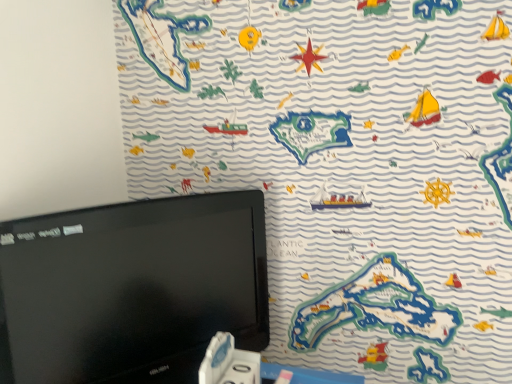
In order to face white plastic game controller at bottom, should I rotate leftwards or rightwards?

A 3.357 degree turn to the left will do.

I want to click on white plastic game controller at bottom, so click(228, 363).

Image resolution: width=512 pixels, height=384 pixels. Describe the element at coordinates (228, 363) in the screenshot. I see `white plastic game controller at bottom` at that location.

What do you see at coordinates (131, 289) in the screenshot?
I see `black glossy monitor at upper left` at bounding box center [131, 289].

Where is `black glossy monitor at upper left`? This screenshot has width=512, height=384. black glossy monitor at upper left is located at coordinates point(131,289).

The image size is (512, 384). Identify the location of white plastic game controller at bottom. (228, 363).

Can you confirm if black glossy monitor at upper left is positioned to the left of white plastic game controller at bottom?

Yes.

Is black glossy monitor at upper left in front of or behind white plastic game controller at bottom in the image?

Visually, black glossy monitor at upper left is located in front of white plastic game controller at bottom.

Does point (95, 359) lie in front of point (224, 333)?

Yes.

From the image's perspective, which one is positioned higher, black glossy monitor at upper left or white plastic game controller at bottom?

black glossy monitor at upper left is shown above in the image.

From a real-world perspective, is black glossy monitor at upper left over white plastic game controller at bottom?

Yes, from a real-world perspective, black glossy monitor at upper left is over white plastic game controller at bottom

Between black glossy monitor at upper left and white plastic game controller at bottom, which one has smaller width?

white plastic game controller at bottom.

Does black glossy monitor at upper left have a greater height compared to white plastic game controller at bottom?

Indeed, black glossy monitor at upper left has a greater height compared to white plastic game controller at bottom.

In the scene shown: Is black glossy monitor at upper left bigger than white plastic game controller at bottom?

Yes.

Is white plastic game controller at bottom inside black glossy monitor at upper left?

Actually, white plastic game controller at bottom is outside black glossy monitor at upper left.

Are black glossy monitor at upper left and white plastic game controller at bottom located far from each other?

No.

Is white plastic game controller at bottom at the back of black glossy monitor at upper left?

Yes, black glossy monitor at upper left is positioned with its back facing white plastic game controller at bottom.

How many degrees apart are the facing directions of black glossy monitor at upper left and white plastic game controller at bottom?

The angle between the facing direction of black glossy monitor at upper left and the facing direction of white plastic game controller at bottom is 35 degrees.

At what (x,y) coordinates should I click in order to perform the action: click on game controller behind the black glossy monitor at upper left. Please return your answer as a coordinate pair (x, y). The width and height of the screenshot is (512, 384). Looking at the image, I should click on (228, 363).

Is white plastic game controller at bottom at the left side of black glossy monitor at upper left?

In fact, white plastic game controller at bottom is to the right of black glossy monitor at upper left.

Is white plastic game controller at bottom positioned before black glossy monitor at upper left?

No, white plastic game controller at bottom is further to the viewer.

Which is farther from the camera, (x=254, y=355) or (x=251, y=208)?

The point (x=251, y=208) is behind.

Consider the image. From the image's perspective, which object appears higher, white plastic game controller at bottom or black glossy monitor at upper left?

black glossy monitor at upper left appears higher in the image.

From a real-world perspective, who is located higher, white plastic game controller at bottom or black glossy monitor at upper left?

black glossy monitor at upper left.

Does white plastic game controller at bottom have a greater width compared to black glossy monitor at upper left?

Incorrect, the width of white plastic game controller at bottom does not surpass that of black glossy monitor at upper left.

In terms of height, does white plastic game controller at bottom look taller or shorter compared to black glossy monitor at upper left?

white plastic game controller at bottom is shorter than black glossy monitor at upper left.

Considering the sizes of objects white plastic game controller at bottom and black glossy monitor at upper left in the image provided, who is bigger, white plastic game controller at bottom or black glossy monitor at upper left?

black glossy monitor at upper left.

Choose the correct answer: Is white plastic game controller at bottom inside black glossy monitor at upper left or outside it?

white plastic game controller at bottom is located beyond the bounds of black glossy monitor at upper left.

From the picture: Is white plastic game controller at bottom far away from black glossy monitor at upper left?

They are positioned close to each other.

Is white plastic game controller at bottom oriented away from black glossy monitor at upper left?

Yes.

How different are the orientations of white plastic game controller at bottom and black glossy monitor at upper left in degrees?

35 degrees.

Measure the distance between white plastic game controller at bottom and black glossy monitor at upper left.

A distance of 18.97 centimeters exists between white plastic game controller at bottom and black glossy monitor at upper left.

Locate an element on the screen. computer monitor located above the white plastic game controller at bottom (from a real-world perspective) is located at coordinates (131, 289).

Find the location of a particular element. This screenshot has width=512, height=384. computer monitor that is on the left side of white plastic game controller at bottom is located at coordinates (131, 289).

Locate an element on the screen. computer monitor that appears above the white plastic game controller at bottom (from a real-world perspective) is located at coordinates (131, 289).